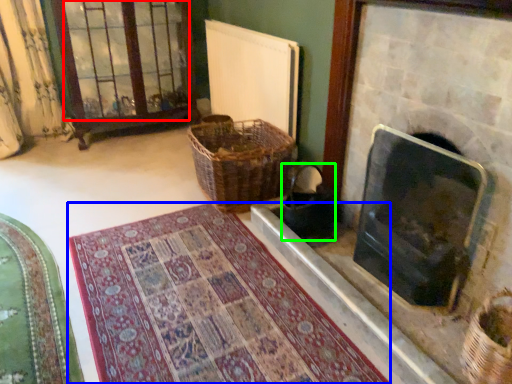
Question: Based on their relative distances, which object is nearer to glass door (highlighted by a red box)? Choose from mat (highlighted by a blue box) and laundry basket (highlighted by a green box).

Choices:
 (A) mat
 (B) laundry basket

Answer: (B)